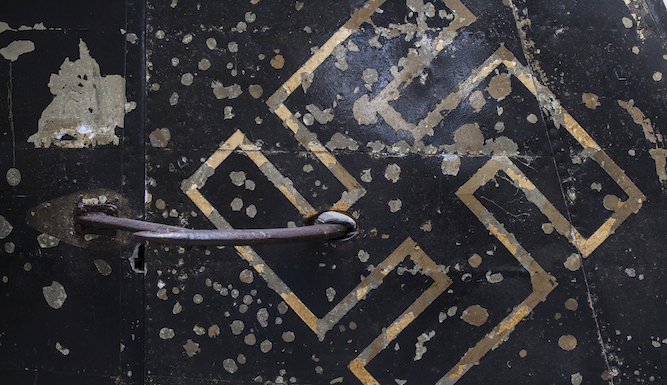
At what (x,y) coordinates should I click in order to perform the action: click on door. Please return your answer as a coordinate pair (x, y). The height and width of the screenshot is (385, 667). Looking at the image, I should click on (201, 121), (611, 343).